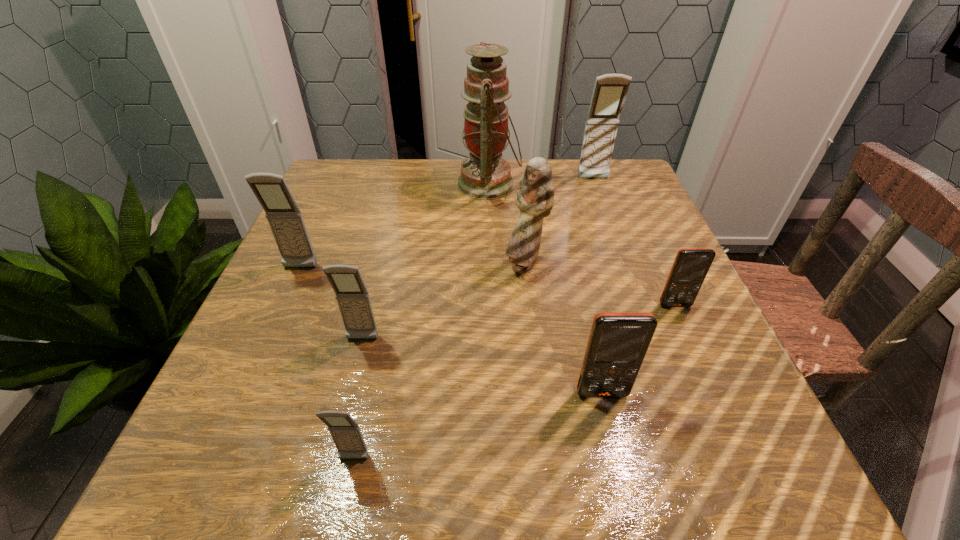
Locate an element on the screen. vacant space at the far left corner of the desktop is located at coordinates (325, 206).

Find the location of a particular element. vacant region at the near left corner is located at coordinates (255, 462).

In the image, there is a desktop. Where is `blank space at the far right corner`? blank space at the far right corner is located at coordinates (613, 180).

Identify the location of free space between the leftmost gray cellular telephone and the second smallest gray cellular telephone. The width and height of the screenshot is (960, 540). (331, 304).

I want to click on unoccupied position between the fifth nearest cellular telephone and the third object from right to left, so click(451, 330).

The width and height of the screenshot is (960, 540). Identify the location of free space between the smaller orange cellular telephone and the second nearest gray cellular telephone. (518, 322).

You are a GUI agent. You are given a task and a screenshot of the screen. Output one action in this format:
    pyautogui.click(x=<x>, y=<y>)
    Task: Click on the free space between the tallest object and the sixth farthest object
    This screenshot has width=960, height=540.
    Given the screenshot: What is the action you would take?
    (425, 262)

Identify the location of vacant area that lies between the nearest object and the leftmost cellular telephone. This screenshot has height=540, width=960. (327, 363).

Where is `vacant area between the fourth nearest cellular telephone and the leftmost gray cellular telephone`? This screenshot has width=960, height=540. vacant area between the fourth nearest cellular telephone and the leftmost gray cellular telephone is located at coordinates (488, 287).

Locate an element on the screen. The image size is (960, 540). free space between the tallest object and the second farthest cellular telephone is located at coordinates (395, 226).